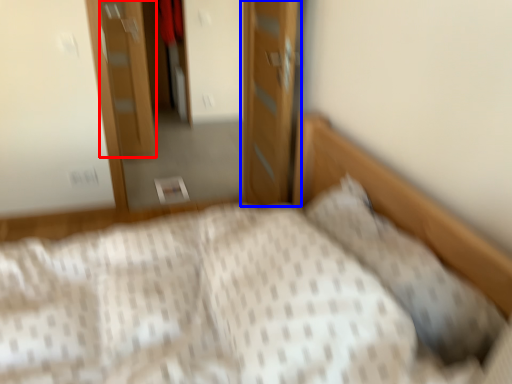
Question: Which object appears farthest to the camera in this image, door (highlighted by a red box) or door (highlighted by a blue box)?

Choices:
 (A) door
 (B) door

Answer: (A)